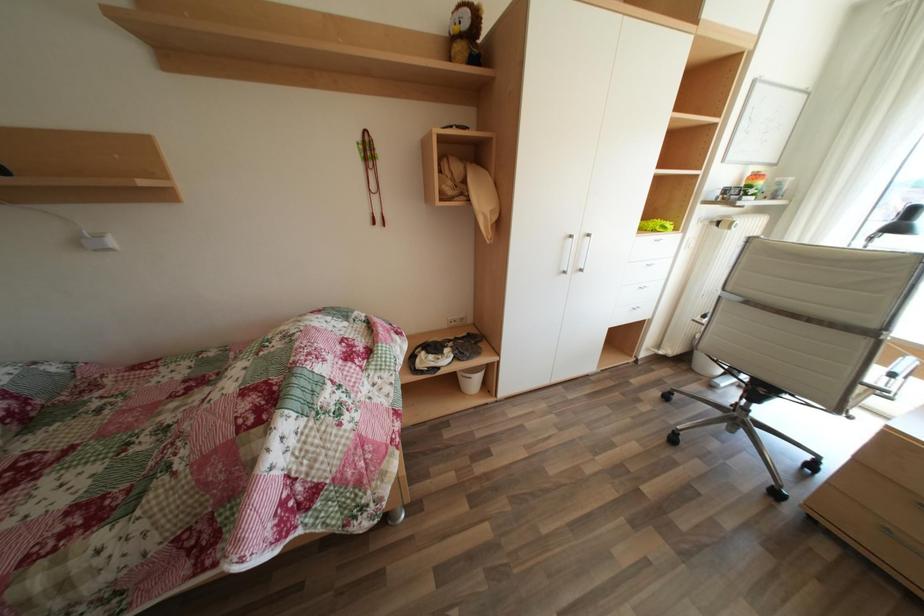
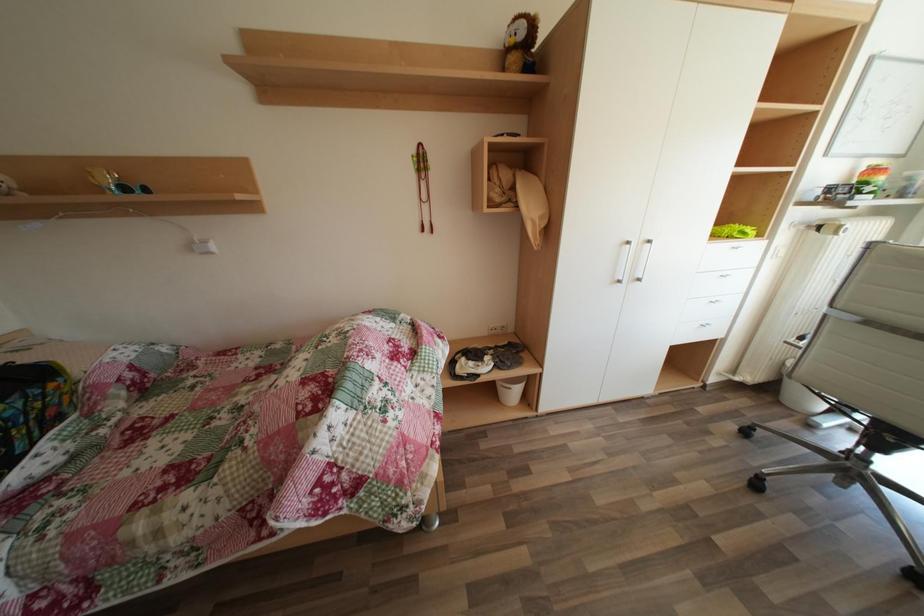
Question: The camera is either moving clockwise (left) or counter-clockwise (right) around the object. The first image is from the beginning of the video and the second image is from the end. Is the camera moving left or right when shooting the video?

Choices:
 (A) Left
 (B) Right

Answer: (B)